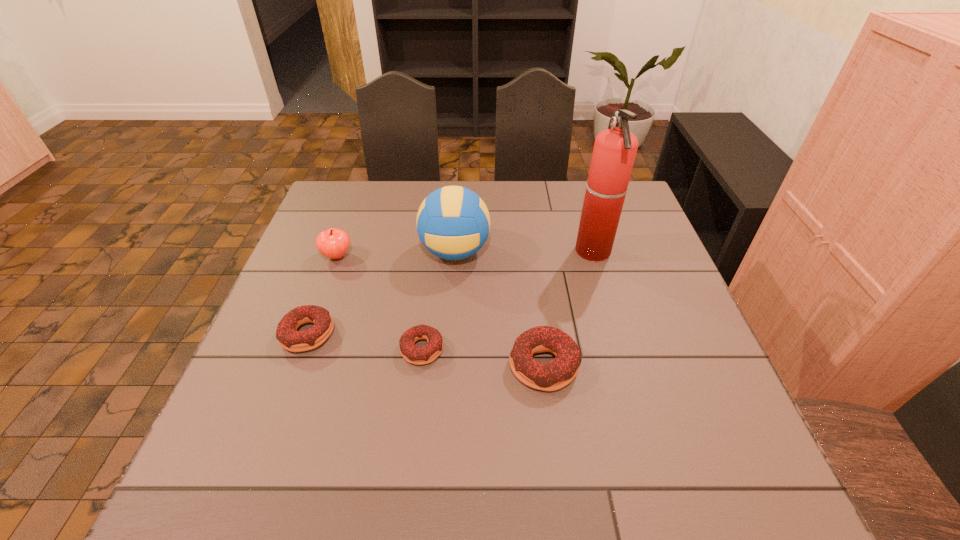
You are a GUI agent. You are given a task and a screenshot of the screen. Output one action in this format:
    pyautogui.click(x=<x>, y=<y>)
    Task: Click on the leftmost doughnut
    Image resolution: width=960 pixels, height=540 pixels.
    Given the screenshot: What is the action you would take?
    pyautogui.click(x=289, y=338)

Find the location of a particular element. The height and width of the screenshot is (540, 960). the second shortest doughnut is located at coordinates (289, 338).

Find the location of a particular element. the shortest doughnut is located at coordinates click(410, 352).

This screenshot has width=960, height=540. I want to click on the shortest object, so click(410, 352).

The width and height of the screenshot is (960, 540). I want to click on the rightmost doughnut, so click(x=558, y=373).

Locate an element on the screen. This screenshot has height=540, width=960. the third shortest object is located at coordinates (558, 373).

Where is `volleyball`? The width and height of the screenshot is (960, 540). volleyball is located at coordinates (453, 223).

Identify the location of the tallest object. The image size is (960, 540). (614, 152).

Identify the location of the rightmost object. (614, 152).

Find the location of a particular element. The image size is (960, 540). the third tallest object is located at coordinates (333, 243).